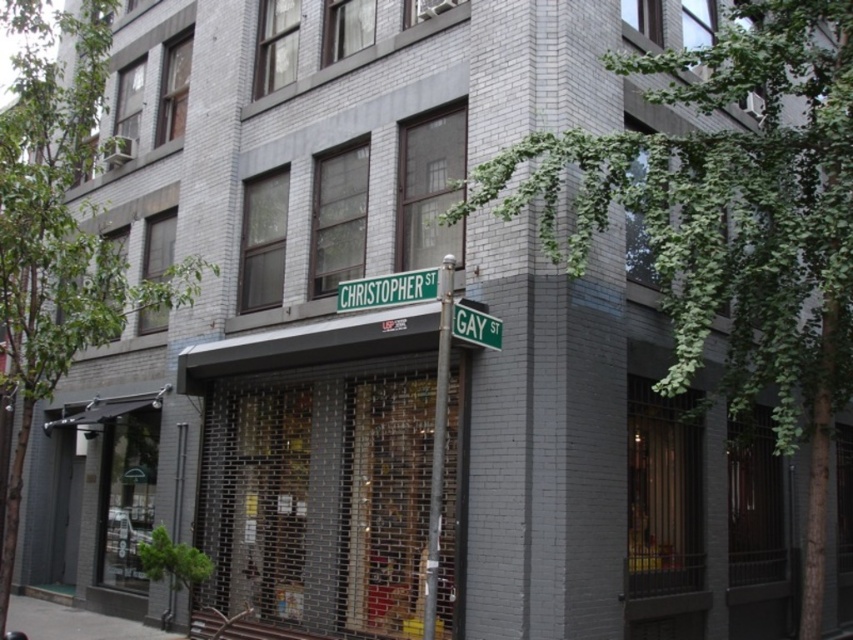
You are standing at the intersection of Christopher Street and Gay Street. You notice a green leafy tree at left and a metallic pole at center. Which object is taller?

The green leafy tree at left is taller than the metallic pole at center.

Looking at this image, you are standing at the intersection of Christopher Street and Gay Street, looking at the building with light gray brick. There are two points marked on the image. One is at point coordinates point (38, 602) and the other at point (387, 285). Which point is closer to you?

Point (387, 285) is closer to you because it is in front of point (38, 602).